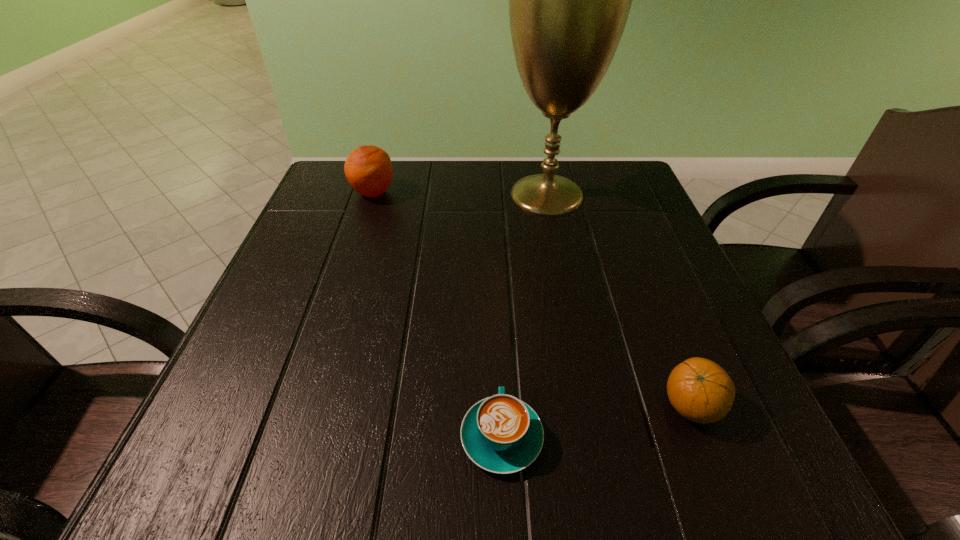
Identify the location of object that is positioned at the far right corner. The image size is (960, 540). (569, 0).

Locate an element on the screen. Image resolution: width=960 pixels, height=540 pixels. object that is at the near right corner is located at coordinates (700, 390).

Where is `vacant space at the far edge`? vacant space at the far edge is located at coordinates (385, 194).

In the image, there is a desktop. At what (x,y) coordinates should I click in order to perform the action: click on free space at the near edge. Please return your answer as a coordinate pair (x, y). This screenshot has height=540, width=960. Looking at the image, I should click on (634, 433).

Where is `free region at the left edge of the desktop`? The height and width of the screenshot is (540, 960). free region at the left edge of the desktop is located at coordinates (268, 422).

The width and height of the screenshot is (960, 540). I want to click on free space at the right edge of the desktop, so click(x=593, y=241).

Where is `free space at the far left corner of the desktop`? free space at the far left corner of the desktop is located at coordinates (314, 205).

Image resolution: width=960 pixels, height=540 pixels. Find the location of `vacant area at the near left corner of the desktop`. vacant area at the near left corner of the desktop is located at coordinates (205, 438).

What are the coordinates of `vacant space at the far right corner of the desktop` in the screenshot? It's located at (647, 194).

Locate an element on the screen. The image size is (960, 540). vacant space at the near right corner is located at coordinates (791, 477).